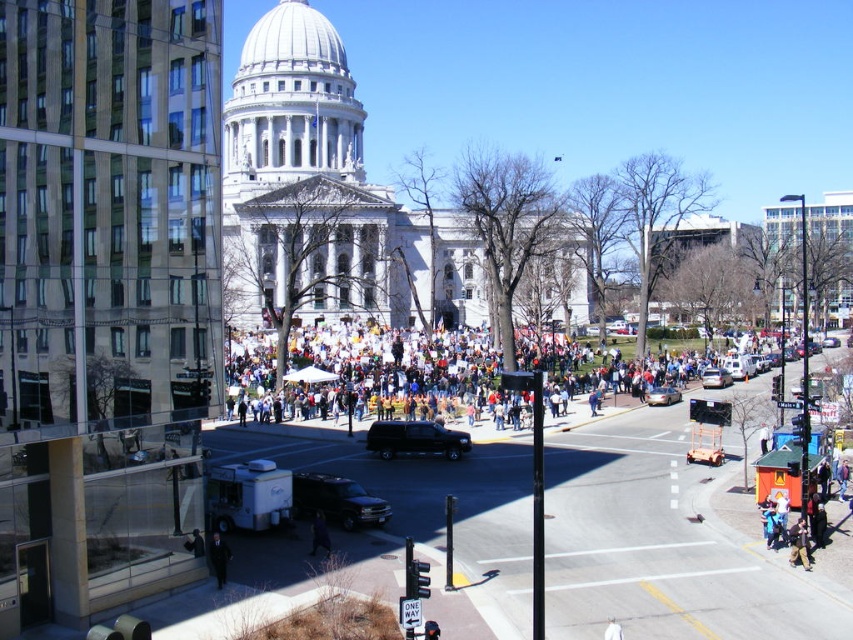
Question: Is dark gray matte suv at lower center wider than dark fabric coat at lower center?

Choices:
 (A) yes
 (B) no

Answer: (A)

Question: Which point is farther to the camera?

Choices:
 (A) (433, 422)
 (B) (718, 376)
 (C) (198, 540)
 (D) (218, 566)

Answer: (B)

Question: Observing the image, what is the correct spatial positioning of dark blue jeans at lower center in reference to metallic silver sedan at center?

Choices:
 (A) right
 (B) left

Answer: (B)

Question: Which is nearer to the white cloth crowd at center?

Choices:
 (A) metallic silver sedan at center
 (B) camouflage fabric jacket at lower right
 (C) dark gray matte suv at lower center

Answer: (A)

Question: Which object is closer to the camera taking this photo?

Choices:
 (A) dark blue suit at lower center
 (B) dark fabric coat at lower center
 (C) white cloth crowd at center
 (D) dark blue jeans at lower center

Answer: (A)

Question: Can you confirm if dark blue suit at lower center is bigger than camouflage fabric jacket at lower right?

Choices:
 (A) no
 (B) yes

Answer: (A)